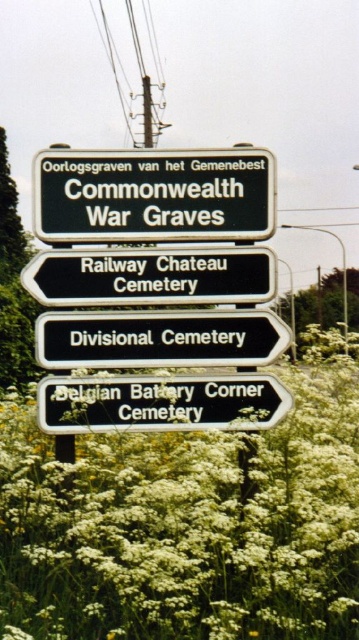
Question: Does black plastic sign at center have a greater width compared to black metal sign at center?

Choices:
 (A) no
 (B) yes

Answer: (B)

Question: Which of the following is the closest to the observer?

Choices:
 (A) (76, 397)
 (B) (117, 356)

Answer: (A)

Question: Can you confirm if white fluffy flowers at center is positioned to the right of black metal sign at center?

Choices:
 (A) yes
 (B) no

Answer: (B)

Question: Based on their relative distances, which object is farther from the green plastic sign at lower right?

Choices:
 (A) black metal sign at upper center
 (B) black metal sign at center
 (C) black plastic sign at center

Answer: (A)

Question: Which is farther from the black metal sign at upper center?

Choices:
 (A) black plastic sign at center
 (B) white fluffy flowers at center

Answer: (B)

Question: Does black metal sign at upper center have a lesser width compared to black plastic sign at center?

Choices:
 (A) yes
 (B) no

Answer: (A)